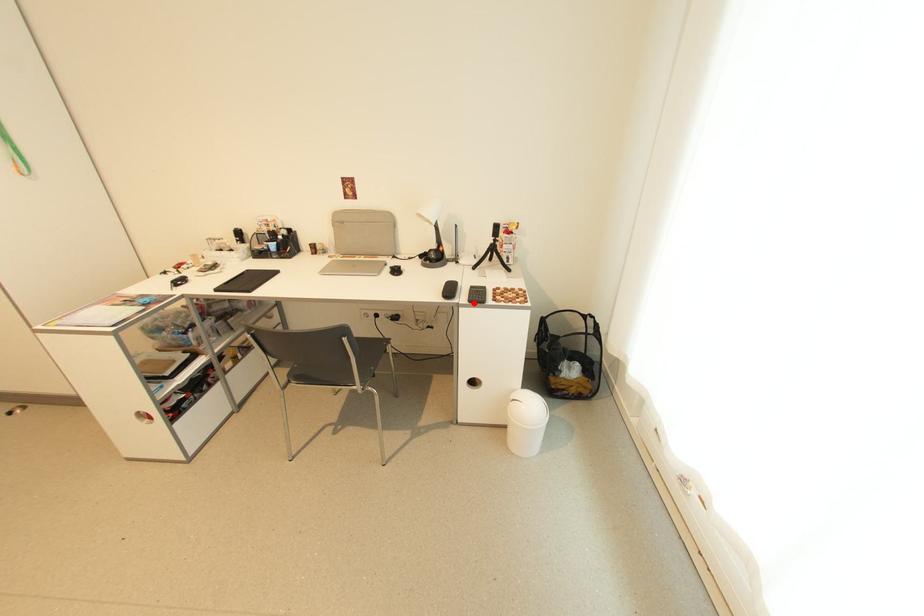
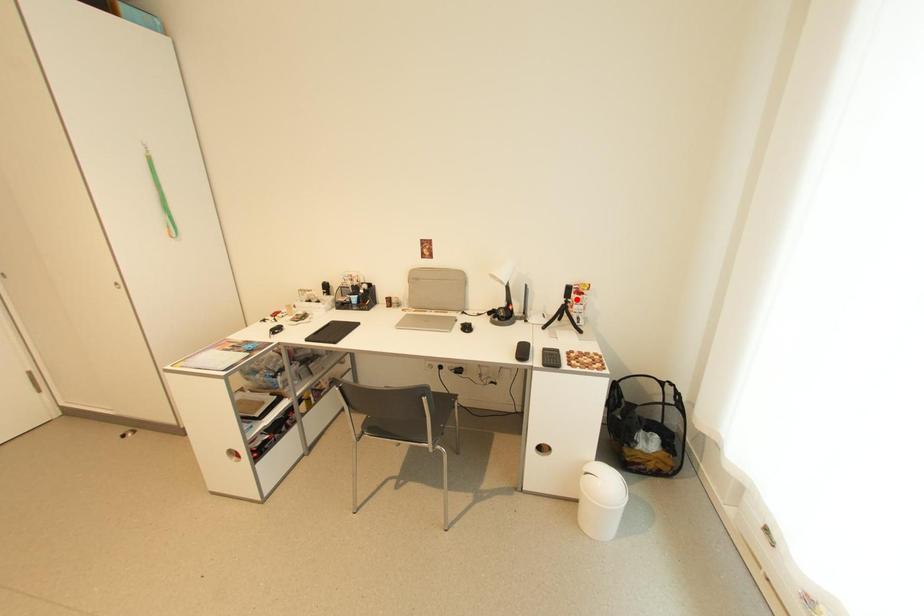
I am providing you with two images of the same scene from different viewpoints. A red point is marked on the first image and another point is marked on the second image. Is the red point in image1 aligned with the point shown in image2?

No